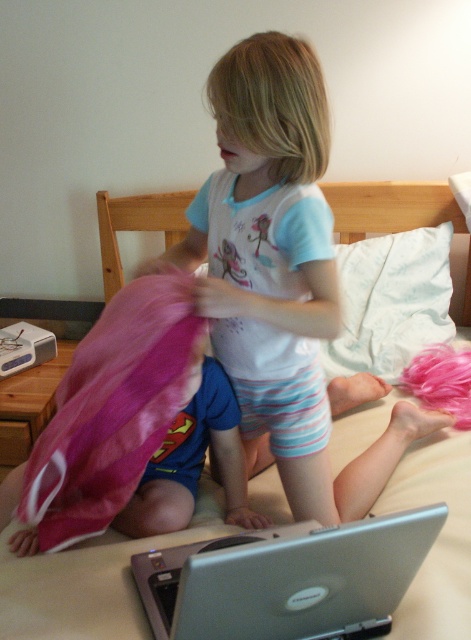
Question: Does white soft bed at center appear under pink fluffy toy at lower right?

Choices:
 (A) yes
 (B) no

Answer: (A)

Question: Which of the following is the farthest from the observer?

Choices:
 (A) silver metallic laptop at lower center
 (B) white soft bed at center
 (C) pink fabric at left
 (D) pink fluffy toy at lower right

Answer: (C)

Question: Can you confirm if silver metallic laptop at lower center is positioned to the left of white soft pillow at upper center?

Choices:
 (A) no
 (B) yes

Answer: (B)

Question: Estimate the real-world distances between objects in this image. Which object is closer to the white soft pillow at upper center?

Choices:
 (A) pink fluffy toy at lower right
 (B) white soft bed at center

Answer: (A)

Question: Which object is positioned farthest from the silver metallic laptop at lower center?

Choices:
 (A) white soft bed at center
 (B) pink fabric at left
 (C) pink fluffy toy at lower right
 (D) white soft pillow at upper center

Answer: (B)

Question: Is pink fluffy toy at lower right positioned behind pink fabric at left?

Choices:
 (A) no
 (B) yes

Answer: (A)